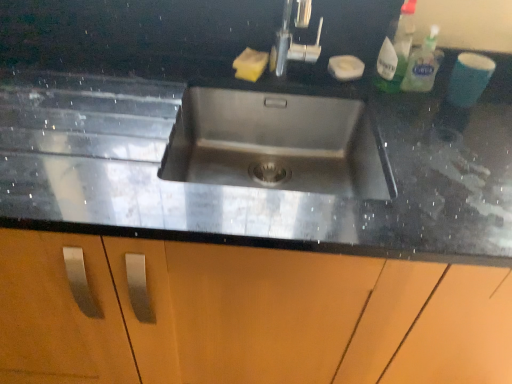
Locate an element on the screen. The image size is (512, 384). vacant space in front of translucent plastic spray bottle at upper right, acting as the 2th cleaning product starting from the right is located at coordinates pyautogui.click(x=411, y=116).